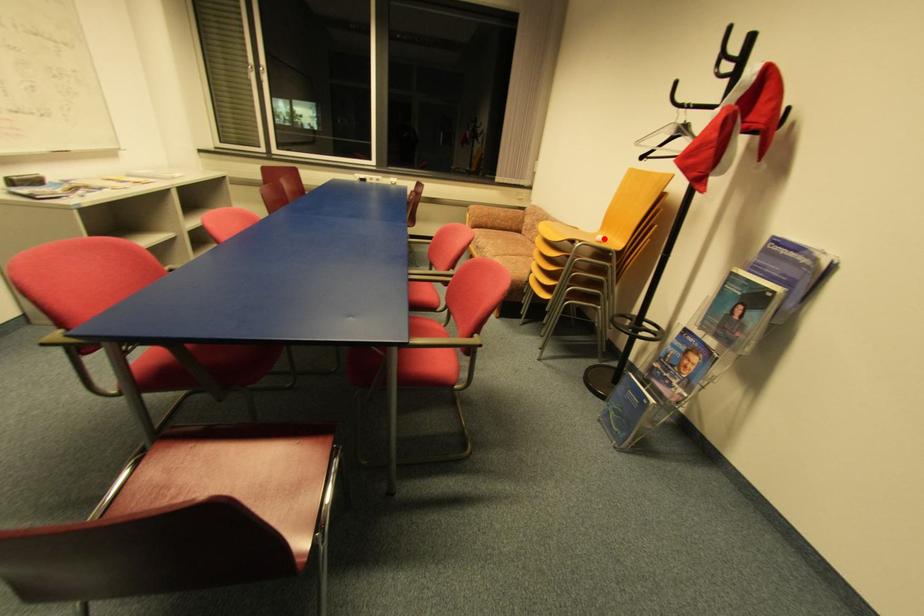
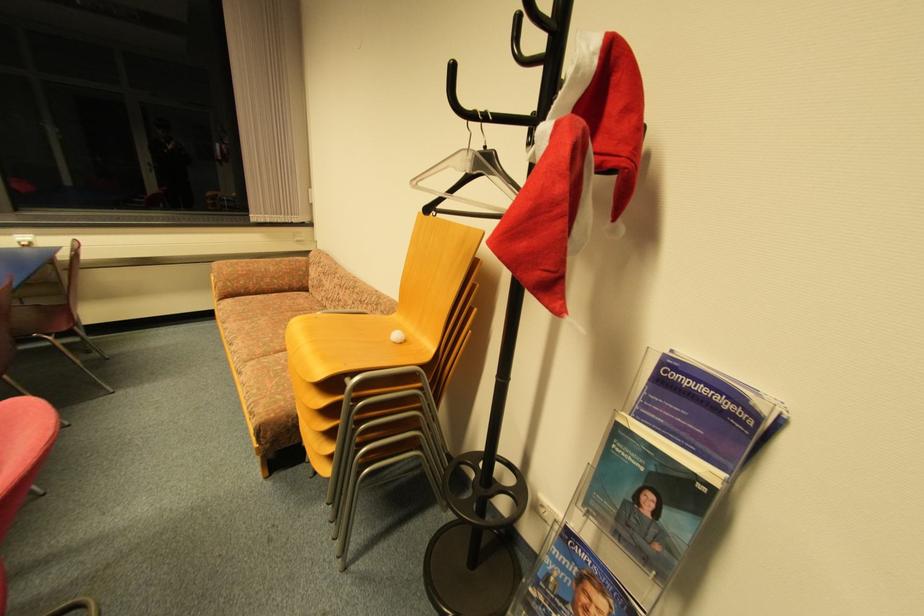
The point at the highlighted location is marked in the first image. Where is the corresponding point in the second image?

(399, 337)